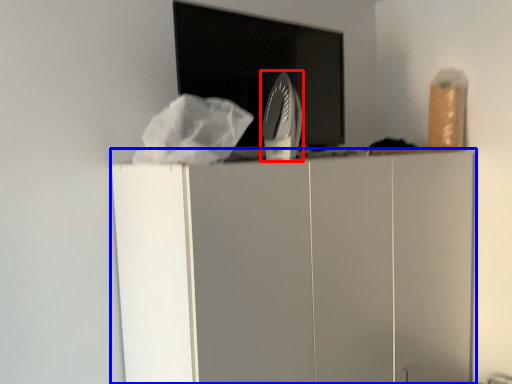
Question: Which point is closer to the camera, home appliance (highlighted by a red box) or furniture (highlighted by a blue box)?

Choices:
 (A) home appliance
 (B) furniture

Answer: (B)